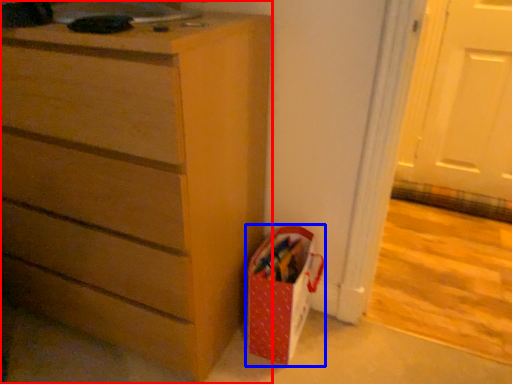
Question: Which of the following is the closest to the observer, chest of drawers (highlighted by a red box) or gift bag (highlighted by a blue box)?

Choices:
 (A) chest of drawers
 (B) gift bag

Answer: (A)